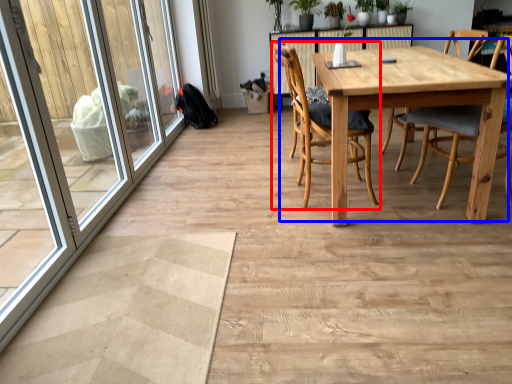
Question: Which point is further to the camera, chair (highlighted by a red box) or kitchen & dining room table (highlighted by a blue box)?

Choices:
 (A) chair
 (B) kitchen & dining room table

Answer: (A)